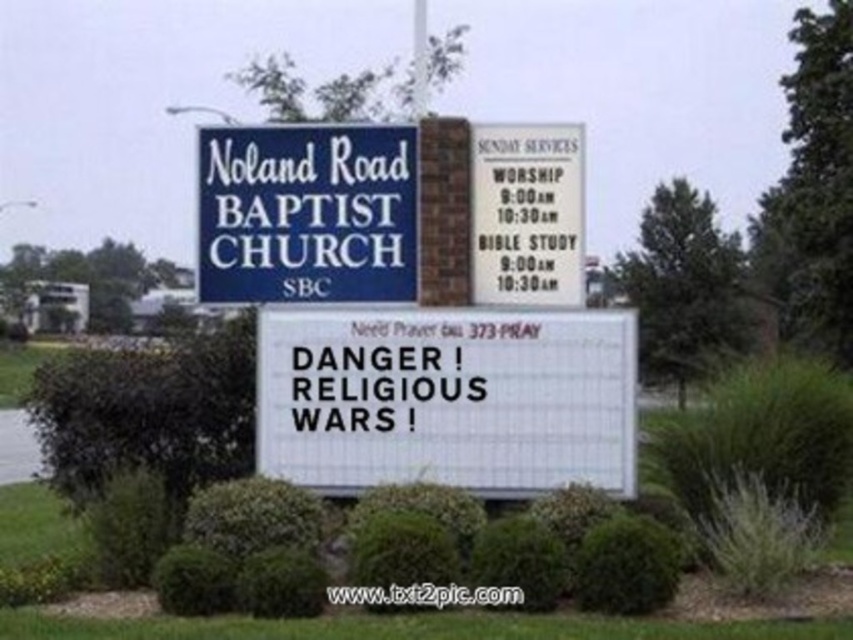
You are standing in front of the church and want to locate the white plastic sign at center. According to the coordinates provided, where should you look relative to the main church sign?

The white plastic sign at center is located at coordinates point [445,397], which means it is positioned slightly to the right and below the main church sign.

You are standing in front of the church sign. There is a point marked at coordinates (445, 397). What object is located at this point?

The point at coordinates (445, 397) corresponds to the white plastic sign at center.

You are standing in front of the church sign. You see a white plastic sign at center and a blue painted wood sign at upper center. Which one is shorter?

The white plastic sign at center is shorter than the blue painted wood sign at upper center.